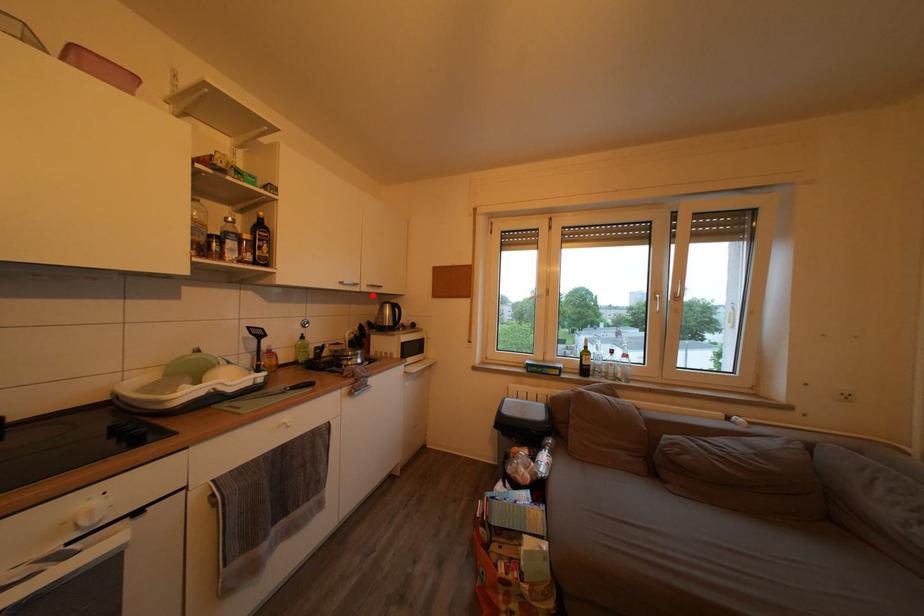
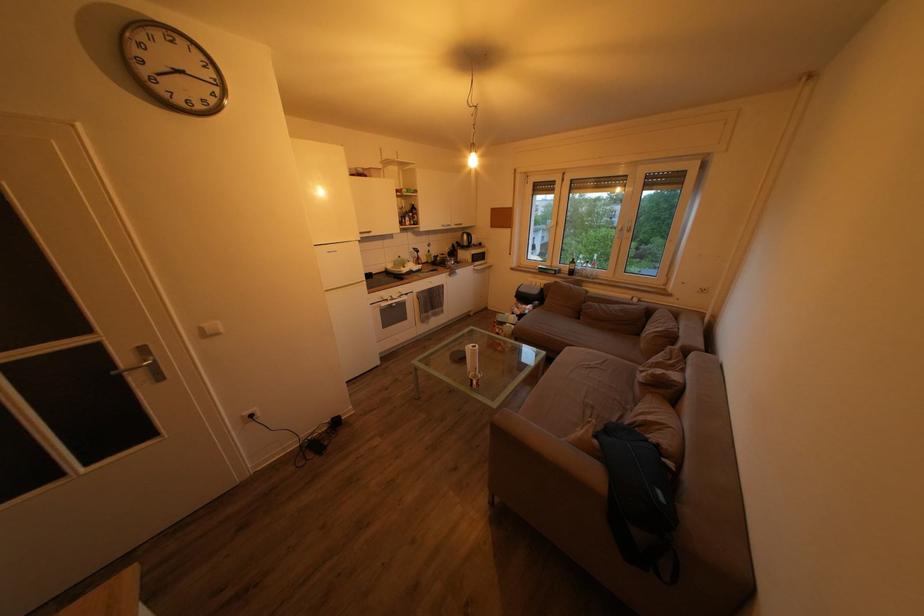
Question: A red point is marked in image1. In image2, is the corresponding 3D point closer to the camera or farther? Reply with the corresponding letter.

Choices:
 (A) The corresponding 3D point is closer.
 (B) The corresponding 3D point is farther.

Answer: (A)